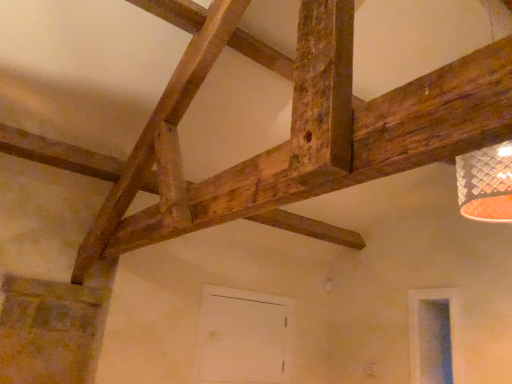
Question: From a real-world perspective, is transparent glass window at lower right located beneath white matte door at center?

Choices:
 (A) no
 (B) yes

Answer: (A)

Question: Does transparent glass window at lower right have a greater height compared to white matte door at center?

Choices:
 (A) no
 (B) yes

Answer: (A)

Question: Is the position of transparent glass window at lower right more distant than that of white matte door at center?

Choices:
 (A) no
 (B) yes

Answer: (A)

Question: Can you confirm if transparent glass window at lower right is bigger than white matte door at center?

Choices:
 (A) no
 (B) yes

Answer: (A)

Question: Is transparent glass window at lower right aimed at white matte door at center?

Choices:
 (A) yes
 (B) no

Answer: (B)

Question: Is transparent glass window at lower right to the left of white matte door at center from the viewer's perspective?

Choices:
 (A) no
 (B) yes

Answer: (A)

Question: Is white matte door at center further to camera compared to transparent glass window at lower right?

Choices:
 (A) yes
 (B) no

Answer: (A)

Question: Does white matte door at center have a lesser width compared to transparent glass window at lower right?

Choices:
 (A) no
 (B) yes

Answer: (A)

Question: Considering the relative sizes of white matte door at center and transparent glass window at lower right in the image provided, is white matte door at center taller than transparent glass window at lower right?

Choices:
 (A) no
 (B) yes

Answer: (B)

Question: From the image's perspective, is white matte door at center beneath transparent glass window at lower right?

Choices:
 (A) no
 (B) yes

Answer: (B)

Question: Would you say transparent glass window at lower right is part of white matte door at center's contents?

Choices:
 (A) no
 (B) yes

Answer: (A)

Question: Does white matte door at center have a larger size compared to transparent glass window at lower right?

Choices:
 (A) no
 (B) yes

Answer: (B)

Question: Is transparent glass window at lower right situated inside white matte door at center or outside?

Choices:
 (A) inside
 (B) outside

Answer: (B)